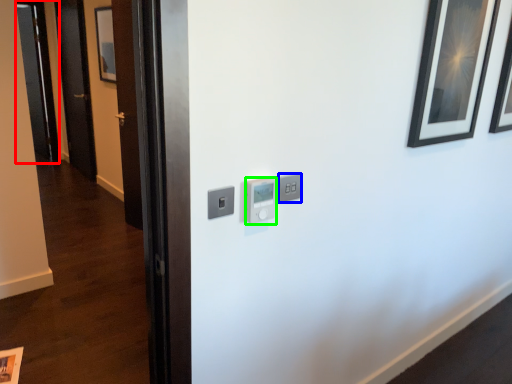
Question: Based on their relative distances, which object is farther from glass door (highlighted by a red box)? Choose from light switch (highlighted by a blue box) and light switch (highlighted by a green box).

Choices:
 (A) light switch
 (B) light switch

Answer: (A)